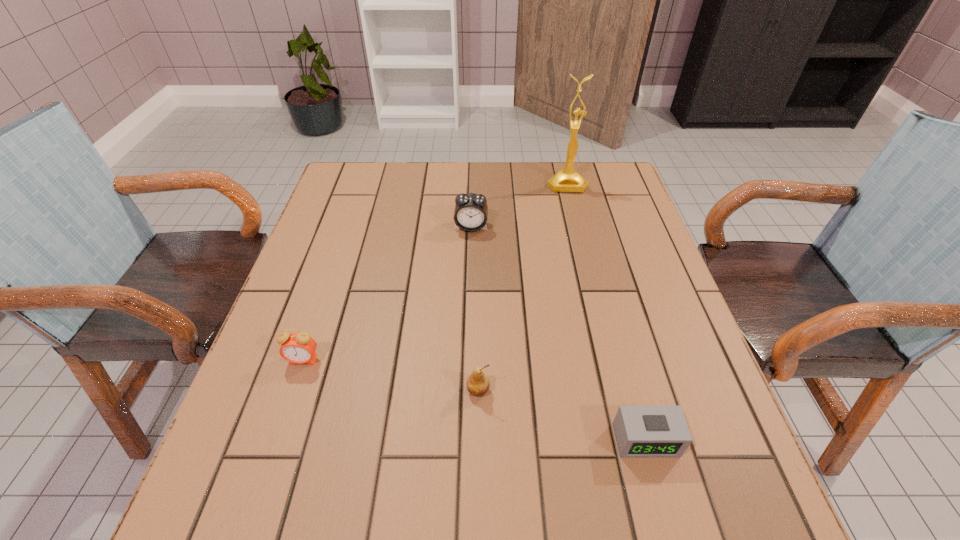
Find the location of `vacant region at the near edge of the desktop`. vacant region at the near edge of the desktop is located at coordinates (511, 504).

Find the location of a particular element. Image resolution: width=960 pixels, height=540 pixels. free space at the left edge is located at coordinates (367, 207).

Locate an element on the screen. The image size is (960, 540). free space at the right edge of the desktop is located at coordinates (604, 243).

Identify the location of free spot between the second farthest alarm clock and the second farthest object. The width and height of the screenshot is (960, 540). (387, 293).

What are the coordinates of `free spot between the third farthest object and the nearest object` in the screenshot? It's located at (474, 400).

Where is `vacant space that is in between the farthest object and the second farthest alarm clock`? vacant space that is in between the farthest object and the second farthest alarm clock is located at coordinates (435, 272).

Where is `vacant area between the nearest alarm clock and the pear`? vacant area between the nearest alarm clock and the pear is located at coordinates (562, 415).

The width and height of the screenshot is (960, 540). I want to click on unoccupied area between the farthest object and the second alarm clock from left to right, so click(518, 205).

At what (x,y) coordinates should I click in order to perform the action: click on vacant area that lies between the pear and the second alarm clock from left to right. Please return your answer as a coordinate pair (x, y). The image size is (960, 540). Looking at the image, I should click on (474, 308).

You are a GUI agent. You are given a task and a screenshot of the screen. Output one action in this format:
    pyautogui.click(x=<x>, y=<y>)
    Task: Click on the free space between the shortest object and the second farthest object
    
    Given the screenshot: What is the action you would take?
    pyautogui.click(x=558, y=333)